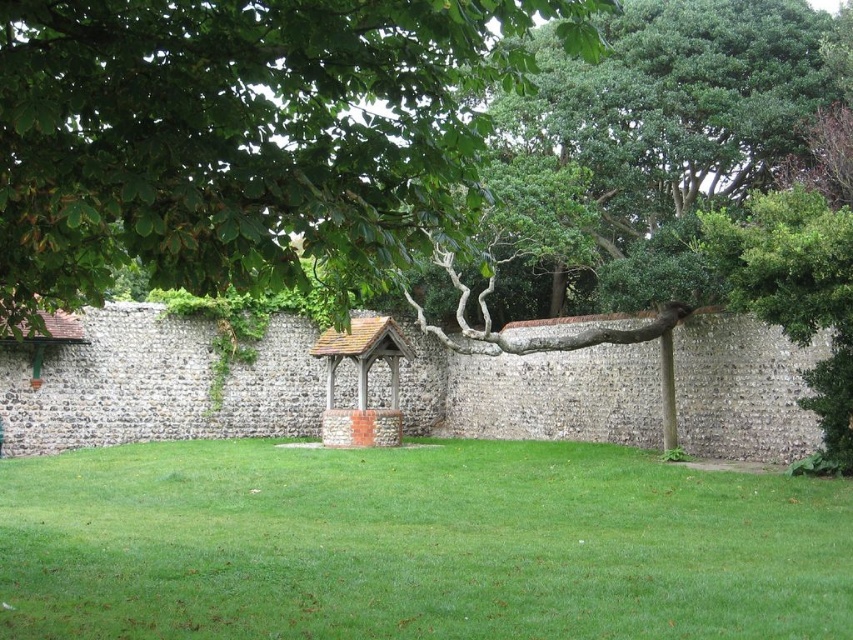
You are standing in the outdoor scene and want to walk towards the green grass at center. Which direction should you walk relative to the green leafy tree at upper left?

You should walk downward towards the green grass at center since it is located below the green leafy tree at upper left.

You are standing at the entrance of the enclosure and want to reach the green grass at center. Based on the coordinates provided, in which direction should you move relative to your current position?

The green grass at center is located at coordinates point (415, 545), so you should move towards the center of the enclosure to reach it.

Consider the image. You are planning to place a 3 meter wide picnic blanket in the green grass at center. Considering the green leafy tree at upper left is nearby, will the blanket fit without overlapping the tree?

Result: The green grass at center is wider than the green leafy tree at upper left, so the 3 meter wide picnic blanket can fit in the green grass at center without overlapping the tree.